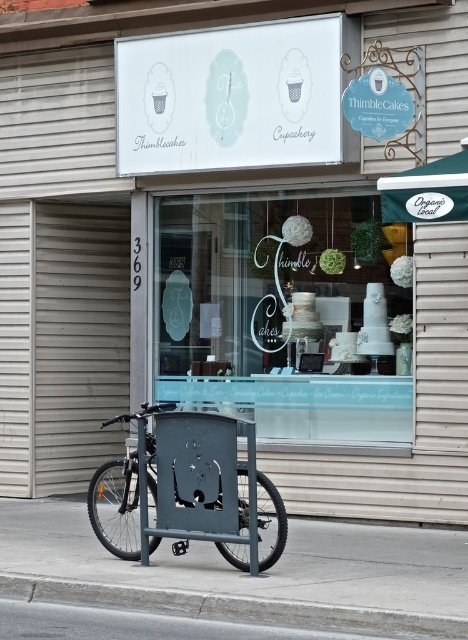
Does gray concrete curb at lower left have a lesser width compared to black rubber wheel at lower center?

No, gray concrete curb at lower left is not thinner than black rubber wheel at lower center.

Is point (236, 602) farther from camera compared to point (269, 508)?

No, it is not.

Find the location of a particular element. gray concrete curb at lower left is located at coordinates (232, 608).

Is gray concrete pavement at lower left bigger than black rubber wheel at lower left?

No, gray concrete pavement at lower left is not bigger than black rubber wheel at lower left.

Image resolution: width=468 pixels, height=640 pixels. Describe the element at coordinates (248, 573) in the screenshot. I see `gray concrete pavement at lower left` at that location.

Is point (242, 589) positioned in front of point (105, 540)?

That is True.

This screenshot has height=640, width=468. Identify the location of gray concrete pavement at lower left. (248, 573).

Describe the element at coordinates (286, 312) in the screenshot. I see `clear glass window at center` at that location.

Does clear glass window at center appear on the left side of black rubber wheel at lower center?

In fact, clear glass window at center is to the right of black rubber wheel at lower center.

Does point (371, 321) come behind point (263, 493)?

Yes, it is behind point (263, 493).

You are a GUI agent. You are given a task and a screenshot of the screen. Output one action in this format:
    pyautogui.click(x=<x>, y=<y>)
    Task: Click on the clear glass window at center
    
    Given the screenshot: What is the action you would take?
    pyautogui.click(x=286, y=312)